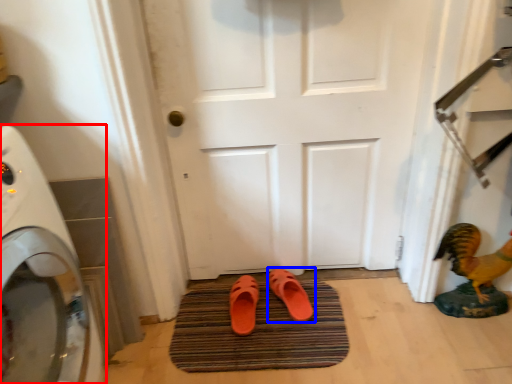
Question: Among these objects, which one is nearest to the camera, home appliance (highlighted by a red box) or footwear (highlighted by a blue box)?

Choices:
 (A) home appliance
 (B) footwear

Answer: (A)